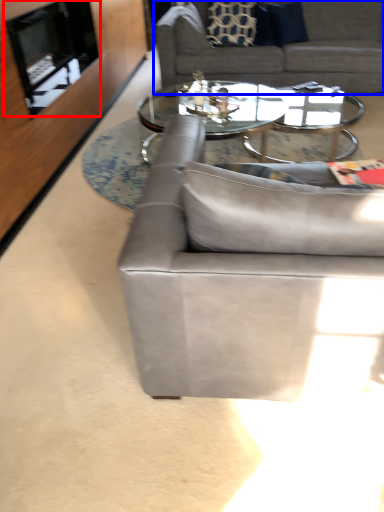
Question: Which object is further to the camera taking this photo, fireplace (highlighted by a red box) or studio couch (highlighted by a blue box)?

Choices:
 (A) fireplace
 (B) studio couch

Answer: (B)